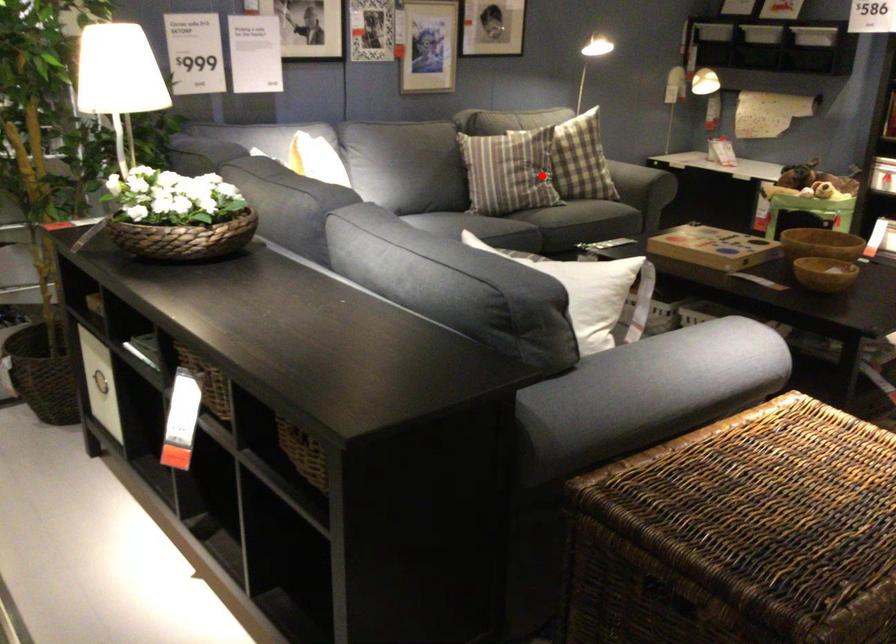
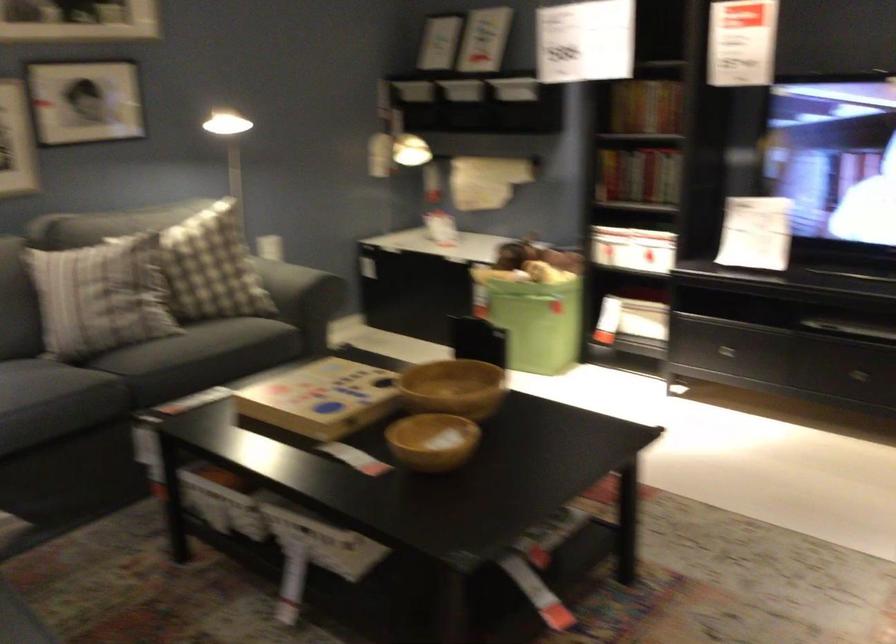
Where in the second image is the point corresponding to the highlighted location from the first image?

(99, 296)